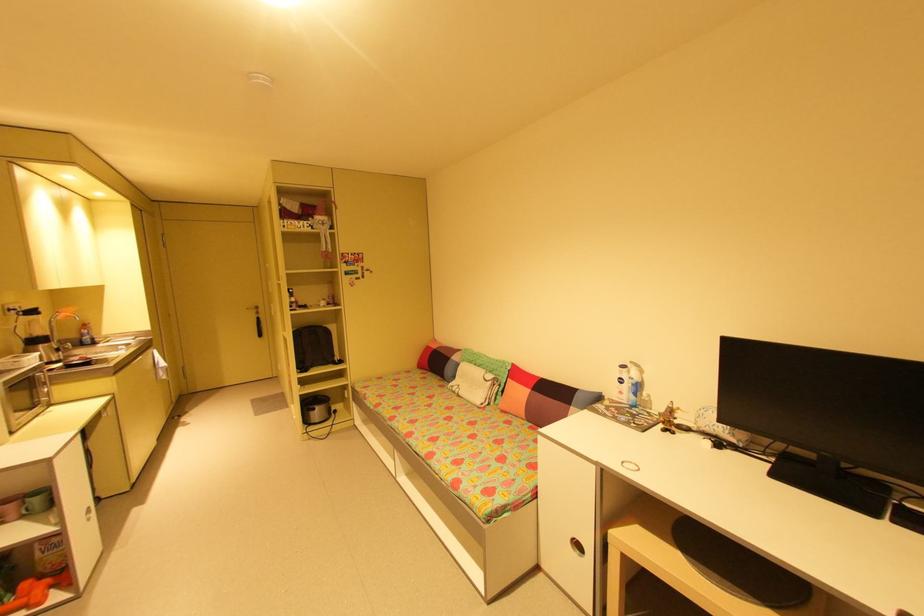
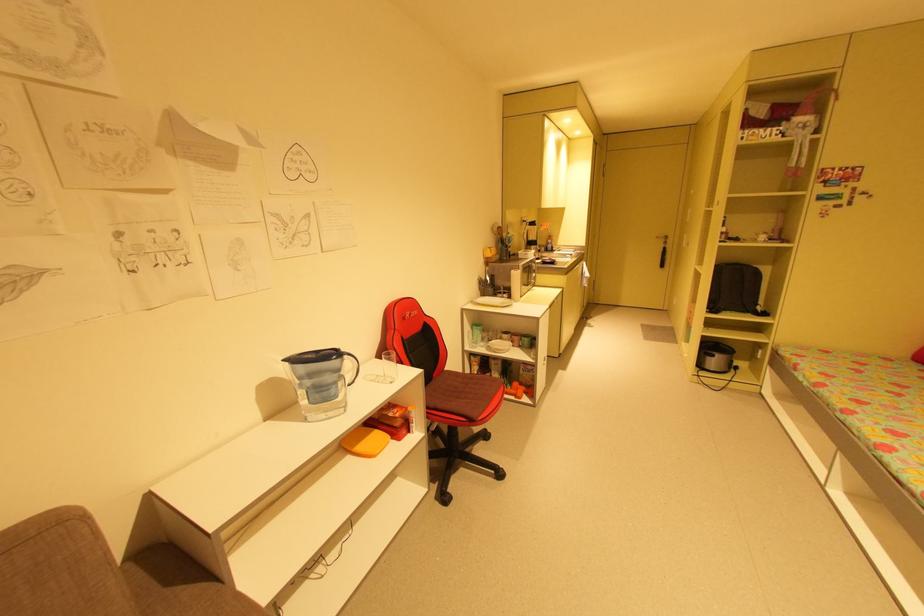
Question: How did the camera likely rotate?

Choices:
 (A) Left
 (B) Right
 (C) Up
 (D) Down

Answer: (A)